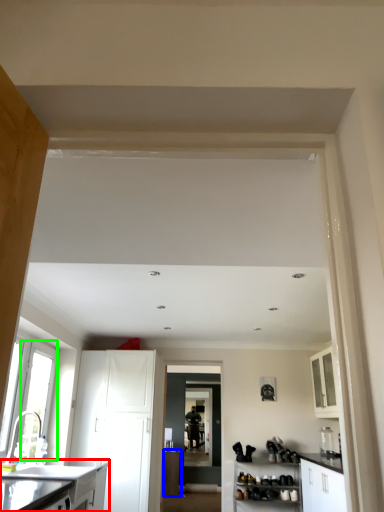
Question: Estimate the real-world distances between objects in this image. Which object is closer to cabinetry (highlighted by a red box), cabinetry (highlighted by a blue box) or window (highlighted by a green box)?

Choices:
 (A) cabinetry
 (B) window

Answer: (B)